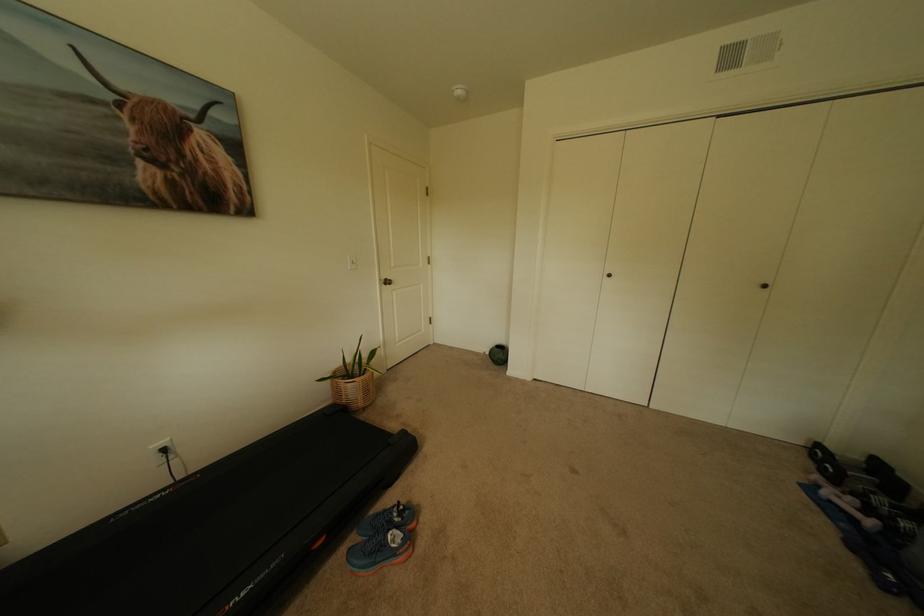
At what (x,y) coordinates should I click in order to perform the action: click on green round vase. Please return your answer as a coordinate pair (x, y). Looking at the image, I should click on coord(497,354).